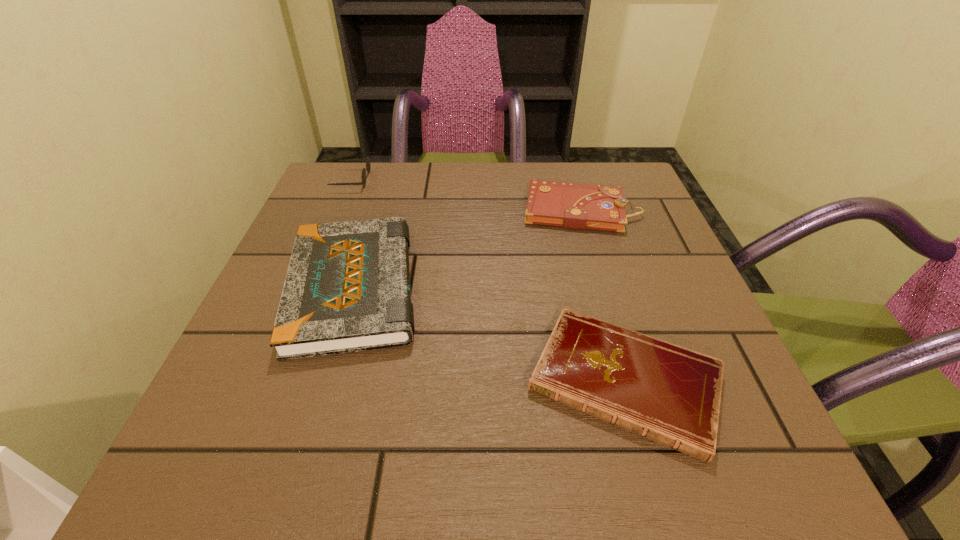
You are a GUI agent. You are given a task and a screenshot of the screen. Output one action in this format:
    pyautogui.click(x=<x>, y=<y>)
    Task: Click on the vacant space at the far right corner
    
    Given the screenshot: What is the action you would take?
    pyautogui.click(x=593, y=185)

I want to click on free space between the tallest notebook and the shortest notebook, so click(489, 334).

Where is `empty space between the leftmost notebook and the second shortest object`? empty space between the leftmost notebook and the second shortest object is located at coordinates (467, 248).

At what (x,y) coordinates should I click in order to perform the action: click on vacant space that's between the sunglasses and the shortest object. Please return your answer as a coordinate pair (x, y). Looking at the image, I should click on (488, 280).

I want to click on free spot between the shortest notebook and the sunglasses, so click(488, 280).

Identify the location of empty space that is in between the shortest notebook and the second shortest object. This screenshot has height=540, width=960. (603, 295).

You are a GUI agent. You are given a task and a screenshot of the screen. Output one action in this format:
    pyautogui.click(x=<x>, y=<y>)
    Task: Click on the vacant space in between the second tallest notebook and the leftmost notebook
    
    Given the screenshot: What is the action you would take?
    pyautogui.click(x=467, y=248)

Identify the location of free spot between the sunglasses and the shortest object. (488, 280).

Image resolution: width=960 pixels, height=540 pixels. I want to click on free area in between the shortest object and the sunglasses, so click(x=488, y=280).

In order to click on vacant space that is in between the second tallest notebook and the sunglasses in this screenshot , I will do `click(466, 194)`.